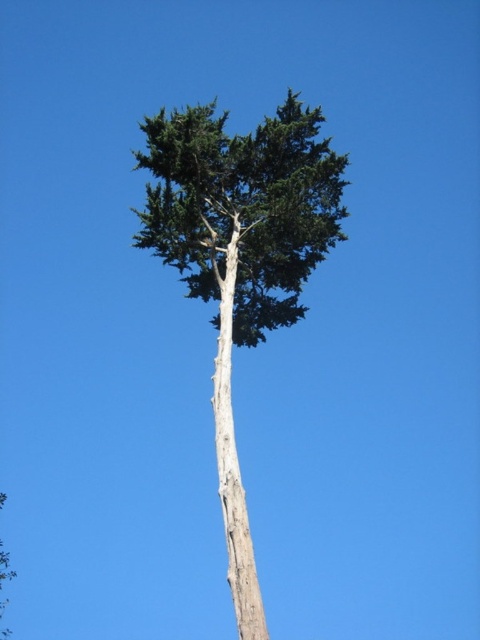
You are standing in a forest and see the green rough bark tree at center and the light brown bark tree trunk at center. Which one is positioned to the left?

The green rough bark tree at center is positioned to the left of the light brown bark tree trunk at center.

In the scene shown: You are a painter standing at the base of the green rough bark tree at center and light brown bark tree trunk at center. You want to paint both trees but can only move 5 feet forward. Can you reach both trees within your movement limit?

The green rough bark tree at center and light brown bark tree trunk at center are 7.60 feet apart from each other. Since you can only move 5 feet forward, you cannot reach both trees within your movement limit.

You are a bird looking for a place to perch. You see the green rough bark tree at center and the light brown bark tree trunk at center. Which part of the tree would you choose to land on if you want to be higher up?

The green rough bark tree at center is located above the light brown bark tree trunk at center, so you should choose the green rough bark tree at center to land on if you want to be higher up.